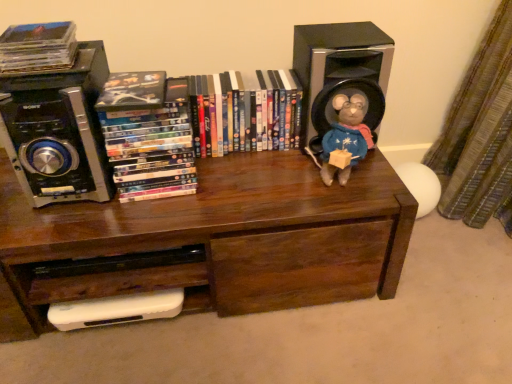
The image size is (512, 384). Find the location of `free space above brown wood bookcase at center (from a real-world perspective)`. free space above brown wood bookcase at center (from a real-world perspective) is located at coordinates (180, 184).